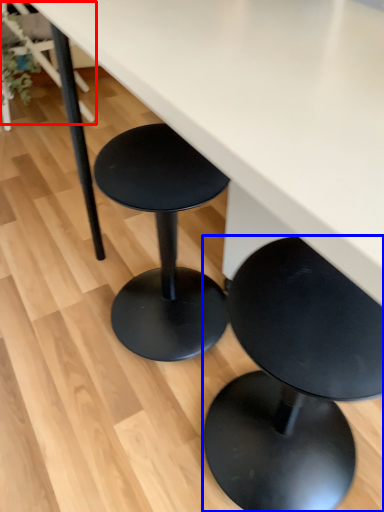
Question: Which object is further to the camera taking this photo, chair (highlighted by a red box) or stool (highlighted by a blue box)?

Choices:
 (A) chair
 (B) stool

Answer: (A)